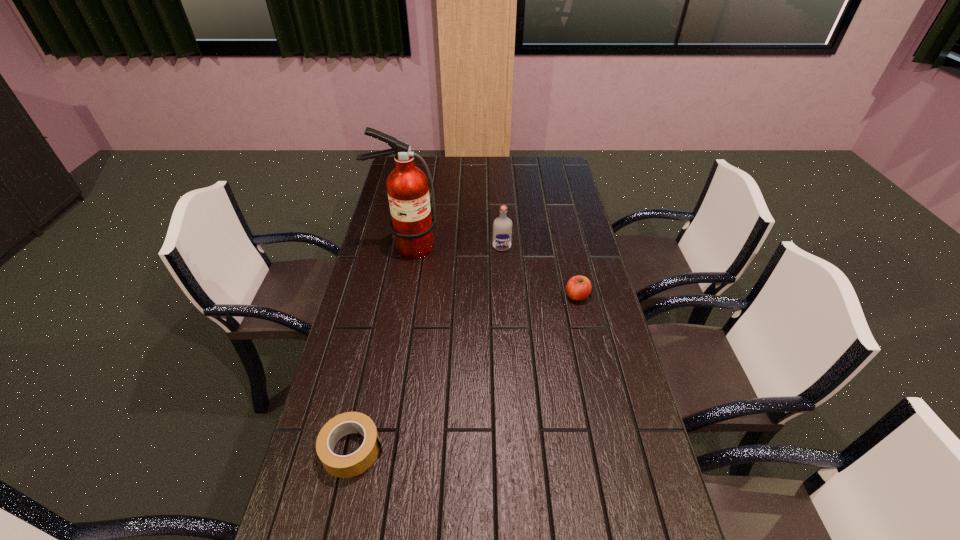
Locate an element on the screen. The width and height of the screenshot is (960, 540). free space that satisfies the following two spatial constraints: 1. on the label of the third object from left to right; 2. at the edge of the duct tape is located at coordinates (514, 449).

Where is `free space that satisfies the following two spatial constraints: 1. on the nozzle and handle of the fire extinguisher; 2. at the edge of the duct tape`? The height and width of the screenshot is (540, 960). free space that satisfies the following two spatial constraints: 1. on the nozzle and handle of the fire extinguisher; 2. at the edge of the duct tape is located at coordinates click(368, 449).

Where is `free location that satisfies the following two spatial constraints: 1. on the nozzle and handle of the tallest object; 2. at the edge of the shortest object`? The width and height of the screenshot is (960, 540). free location that satisfies the following two spatial constraints: 1. on the nozzle and handle of the tallest object; 2. at the edge of the shortest object is located at coordinates (368, 449).

Where is `free spot that satisfies the following two spatial constraints: 1. on the front side of the second nearest object; 2. at the edge of the shortest object`? free spot that satisfies the following two spatial constraints: 1. on the front side of the second nearest object; 2. at the edge of the shortest object is located at coordinates [612, 449].

Locate an element on the screen. free location that satisfies the following two spatial constraints: 1. on the label of the third object from left to right; 2. at the edge of the nearest object is located at coordinates (514, 449).

Find the location of `vacant point that satisfies the following two spatial constraints: 1. on the label of the vodka; 2. at the edge of the shortest object`. vacant point that satisfies the following two spatial constraints: 1. on the label of the vodka; 2. at the edge of the shortest object is located at coordinates (514, 449).

The image size is (960, 540). What are the coordinates of `blank space that satisfies the following two spatial constraints: 1. on the label of the second tallest object; 2. at the edge of the shortest object` in the screenshot? It's located at coord(514,449).

At what (x,y) coordinates should I click in order to perform the action: click on vacant point that satisfies the following two spatial constraints: 1. on the nozzle and handle of the tallest object; 2. at the edge of the shortest object. Please return your answer as a coordinate pair (x, y). This screenshot has width=960, height=540. Looking at the image, I should click on pos(368,449).